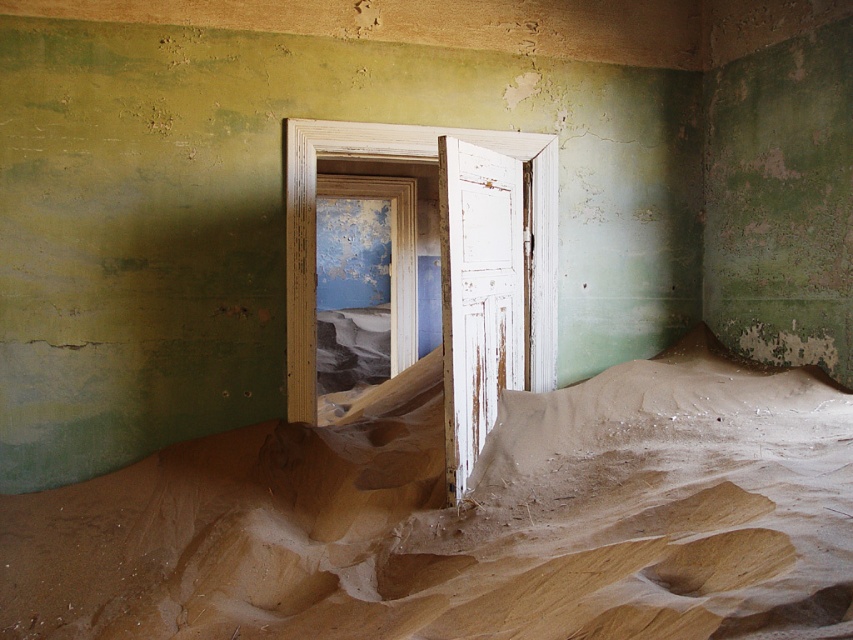
Question: Can you confirm if sandy beige blanket at center is positioned below white weathered wood door at center?

Choices:
 (A) yes
 (B) no

Answer: (A)

Question: Which point is closer to the camera taking this photo?

Choices:
 (A) (440, 259)
 (B) (569, 461)

Answer: (A)

Question: Is sandy beige blanket at center above white weathered wood door at center?

Choices:
 (A) yes
 (B) no

Answer: (B)

Question: Is sandy beige blanket at center positioned before white weathered wood door at center?

Choices:
 (A) yes
 (B) no

Answer: (A)

Question: Which object appears closest to the camera in this image?

Choices:
 (A) sandy beige blanket at center
 (B) white weathered wood door at center

Answer: (A)